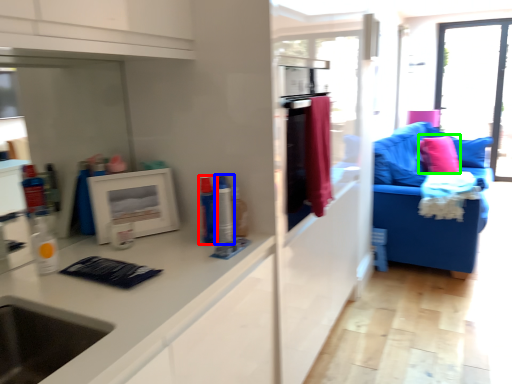
Question: Based on their relative distances, which object is farther from toiletry (highlighted by a red box)? Choose from toiletry (highlighted by a blue box) and pillow (highlighted by a green box).

Choices:
 (A) toiletry
 (B) pillow

Answer: (B)